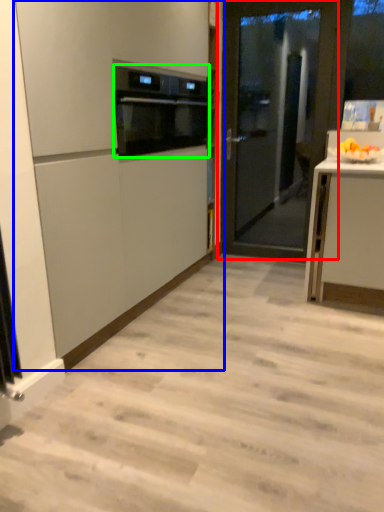
Question: Which object is the closest to the door (highlighted by a red box)? Choose among these: cabinetry (highlighted by a blue box) or kitchen appliance (highlighted by a green box).

Choices:
 (A) cabinetry
 (B) kitchen appliance

Answer: (B)